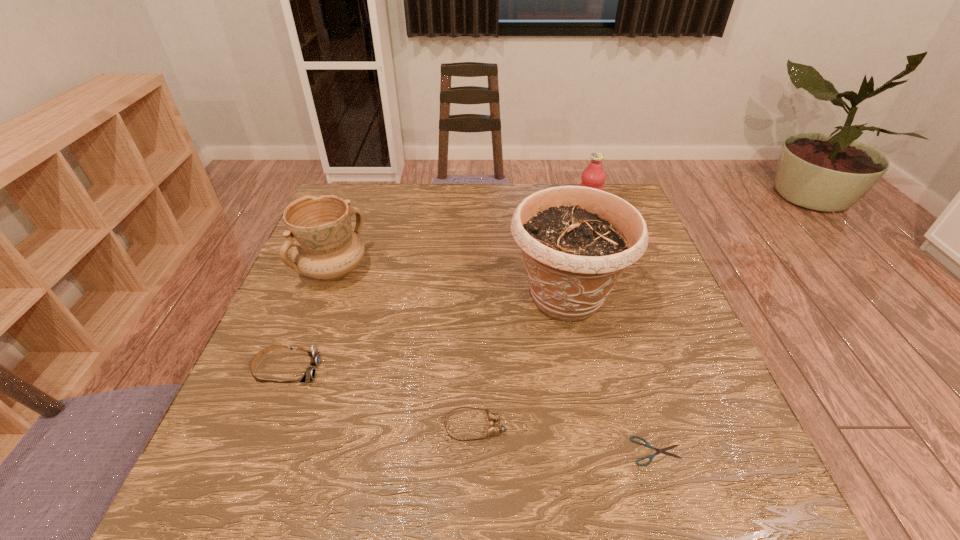
In order to click on flowerpot at the right edge in this screenshot , I will do `click(576, 241)`.

This screenshot has width=960, height=540. What are the coordinates of `fruit juice present at the right edge` in the screenshot? It's located at (594, 176).

Identify the location of shears at the right edge. This screenshot has width=960, height=540. (647, 444).

At what (x,y) coordinates should I click in order to perform the action: click on object located in the far right corner section of the desktop. Please return your answer as a coordinate pair (x, y). This screenshot has height=540, width=960. Looking at the image, I should click on (594, 176).

At what (x,y) coordinates should I click in order to perform the action: click on object at the near right corner. Please return your answer as a coordinate pair (x, y). This screenshot has width=960, height=540. Looking at the image, I should click on (647, 444).

Where is `free space at the far edge`? This screenshot has height=540, width=960. free space at the far edge is located at coordinates (534, 191).

Locate an element on the screen. The width and height of the screenshot is (960, 540). blank space at the left edge of the desktop is located at coordinates (304, 315).

In the image, there is a desktop. Identify the location of vacant space at the right edge. (672, 359).

Where is `vacant space at the far left corner of the desktop`? vacant space at the far left corner of the desktop is located at coordinates (376, 194).

Where is `empty space that is in between the fruit juice and the pottery`? The height and width of the screenshot is (540, 960). empty space that is in between the fruit juice and the pottery is located at coordinates (460, 244).